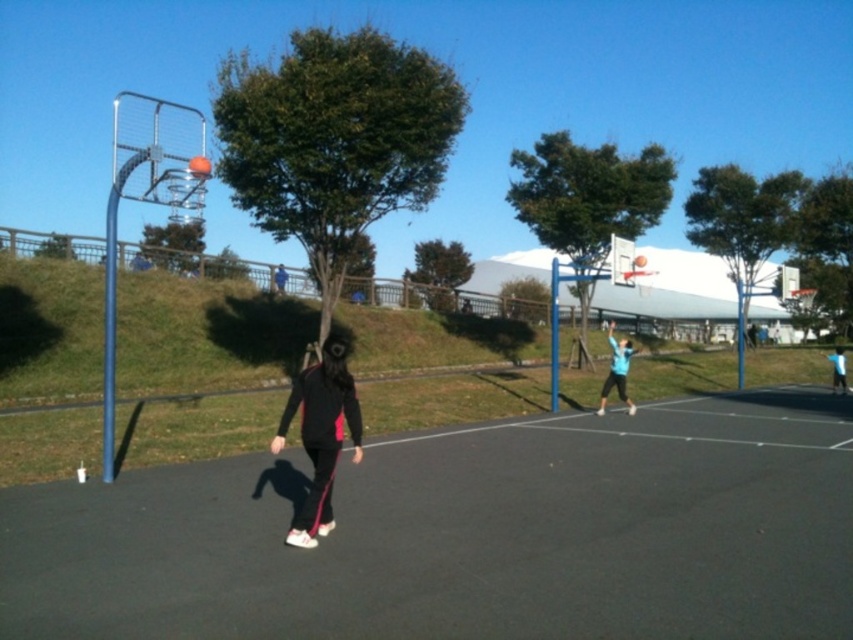
Question: Among these points, which one is nearest to the camera?

Choices:
 (A) (827, 356)
 (B) (317, 404)
 (C) (280, 273)

Answer: (B)

Question: Does blue fabric shirt at right have a greater width compared to black fabric jacket at center?

Choices:
 (A) yes
 (B) no

Answer: (A)

Question: Considering the real-world distances, which object is farthest from the blue fabric shirt at right?

Choices:
 (A) black fabric court at center
 (B) black fabric jacket at center

Answer: (B)

Question: Can you confirm if blue matte basketball player at upper right is bigger than blue fabric shirt at right?

Choices:
 (A) yes
 (B) no

Answer: (A)

Question: Can you confirm if black fabric court at center is positioned above blue matte basketball player at upper right?

Choices:
 (A) no
 (B) yes

Answer: (A)

Question: Among these objects, which one is nearest to the camera?

Choices:
 (A) blue fabric shirt at right
 (B) black matte track pants at center
 (C) black fabric court at center
 (D) black fabric jacket at center

Answer: (C)